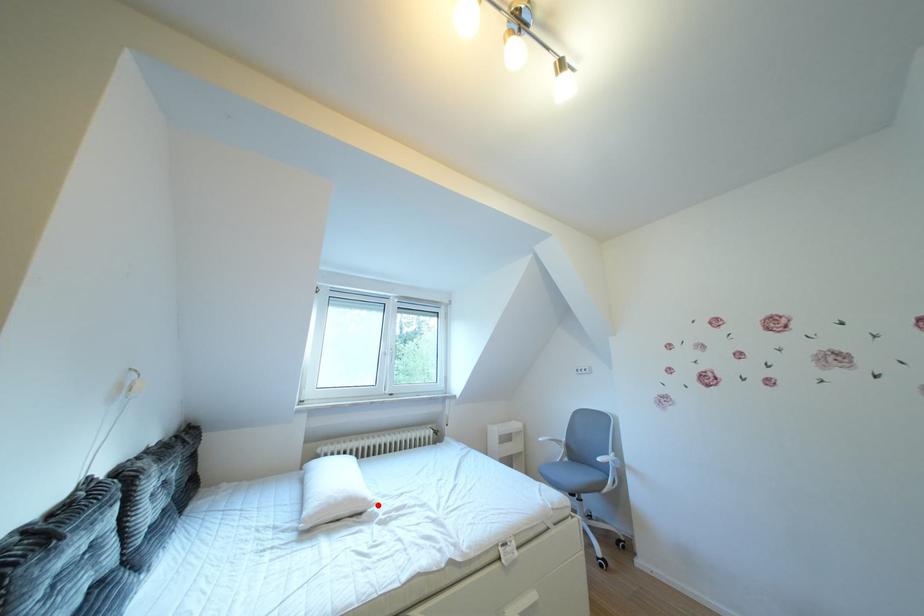
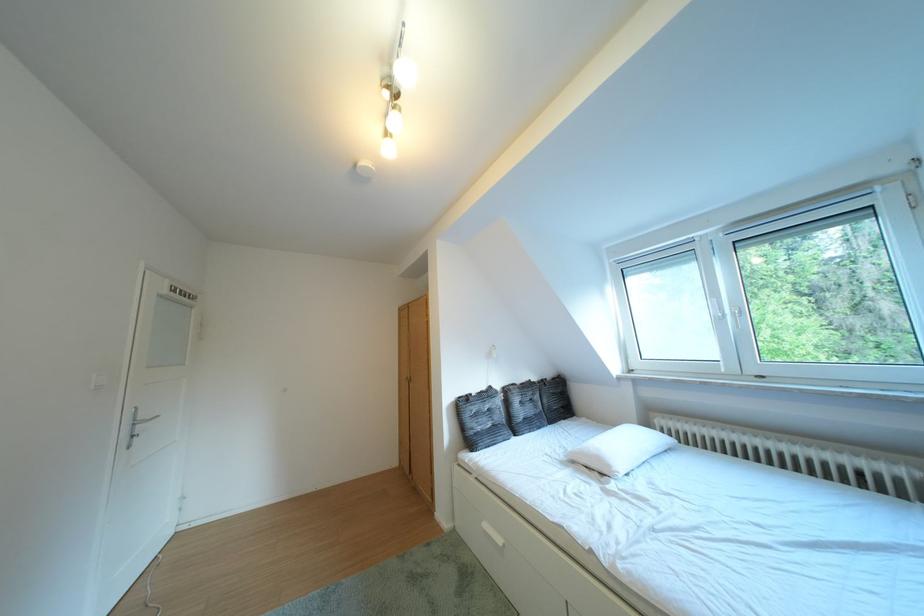
Question: I am providing you with two images of the same scene from different viewpoints. Given a red point in image1, look at the same physical point in image2. Is it:

Choices:
 (A) Closer to the viewpoint
 (B) Farther from the viewpoint

Answer: (B)